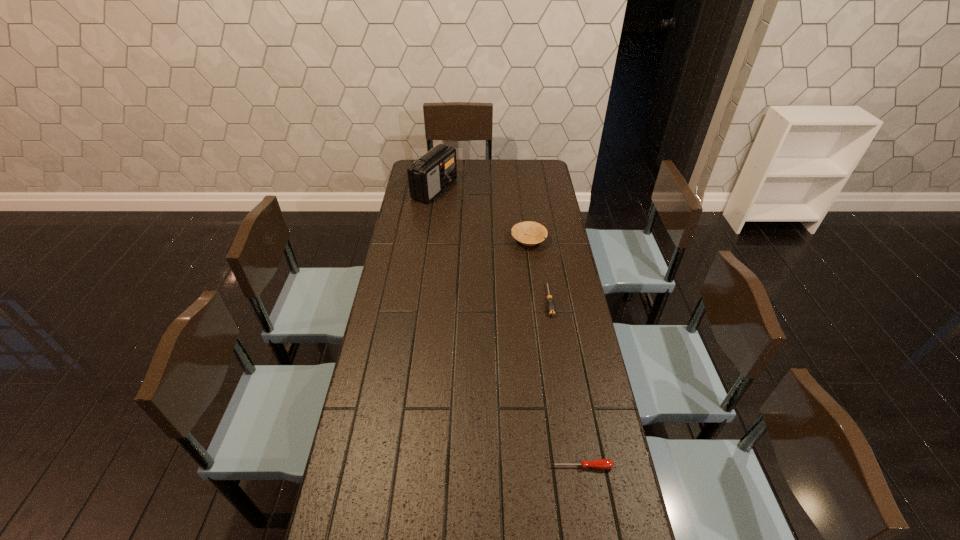
At what (x,y) coordinates should I click in order to perform the action: click on free spot that satisfies the following two spatial constraints: 1. on the front panel of the nearest object; 2. on the right side of the farthest object. Please return your answer as a coordinate pair (x, y). This screenshot has height=540, width=960. Looking at the image, I should click on (396, 467).

Locate an element on the screen. This screenshot has width=960, height=540. vacant region that satisfies the following two spatial constraints: 1. on the back side of the nearest object; 2. on the front panel of the tallest object is located at coordinates (535, 189).

The image size is (960, 540). Find the location of `free location that satisfies the following two spatial constraints: 1. on the front panel of the farther screwdriver; 2. on the left side of the radio receiver`. free location that satisfies the following two spatial constraints: 1. on the front panel of the farther screwdriver; 2. on the left side of the radio receiver is located at coordinates (419, 300).

Locate an element on the screen. vacant point that satisfies the following two spatial constraints: 1. on the front panel of the nearest object; 2. on the left side of the farthest object is located at coordinates (396, 467).

I want to click on vacant area in the image that satisfies the following two spatial constraints: 1. on the front panel of the farthest object; 2. on the right side of the nearest object, so click(x=396, y=467).

The image size is (960, 540). I want to click on free spot that satisfies the following two spatial constraints: 1. on the front panel of the third shortest object; 2. on the right side of the radio receiver, so click(x=427, y=240).

Where is `free space in the image that satisfies the following two spatial constraints: 1. on the front panel of the leftmost object; 2. on the right side of the nearest object`? free space in the image that satisfies the following two spatial constraints: 1. on the front panel of the leftmost object; 2. on the right side of the nearest object is located at coordinates (396, 467).

Identify the location of vacant area in the image that satisfies the following two spatial constraints: 1. on the front side of the third shortest object; 2. on the right side of the nearer screwdriver. (558, 467).

Find the location of a particular element. This screenshot has height=540, width=960. free spot that satisfies the following two spatial constraints: 1. on the front panel of the bowl; 2. on the right side of the radio receiver is located at coordinates (427, 240).

You are a GUI agent. You are given a task and a screenshot of the screen. Output one action in this format:
    pyautogui.click(x=<x>, y=<y>)
    Task: Click on the vacant space that satisfies the following two spatial constraints: 1. on the front panel of the tallest object; 2. on the back side of the third nearest object
    The image size is (960, 540).
    Given the screenshot: What is the action you would take?
    pyautogui.click(x=427, y=240)